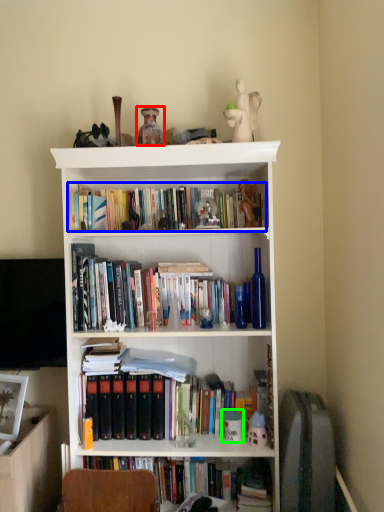
Question: Which is nearer to the toy (highlighted by a red box)? book (highlighted by a blue box) or toy (highlighted by a green box).

Choices:
 (A) book
 (B) toy

Answer: (A)